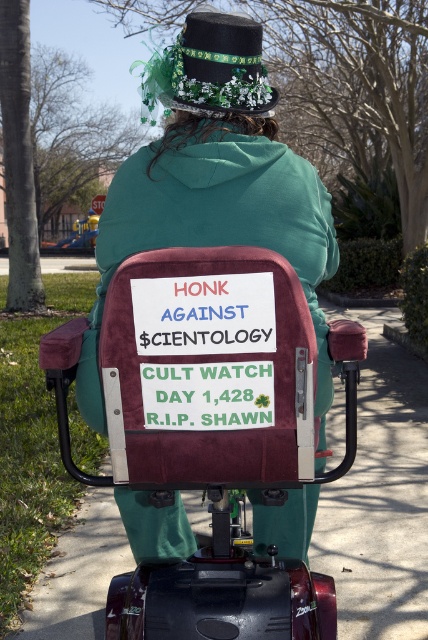
Which of these two, velvety maroon scooter at center or green felt hat at upper center, stands shorter?

green felt hat at upper center is shorter.

Between velvety maroon scooter at center and green felt hat at upper center, which one appears on the left side from the viewer's perspective?

velvety maroon scooter at center is more to the left.

Find the location of a particular element. velvety maroon scooter at center is located at coordinates (214, 182).

Locate an element on the screen. Image resolution: width=428 pixels, height=640 pixels. velvety maroon scooter at center is located at coordinates (214, 182).